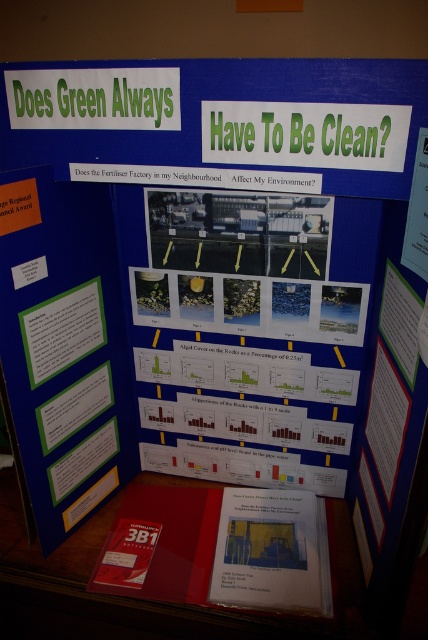
Looking at the science fair display titled Does Green Always Have To Be Clean?, you notice two colored papers. The yellow paper at center and the green paper at upper center. Which of these two papers is bigger in size?

The yellow paper at center is larger in size than the green paper at upper center.

You are a student at the science fair and want to compare the yellow paper at center with the blue display board. How far apart are they?

The yellow paper at center and the blue display board are 91.23 centimeters apart.